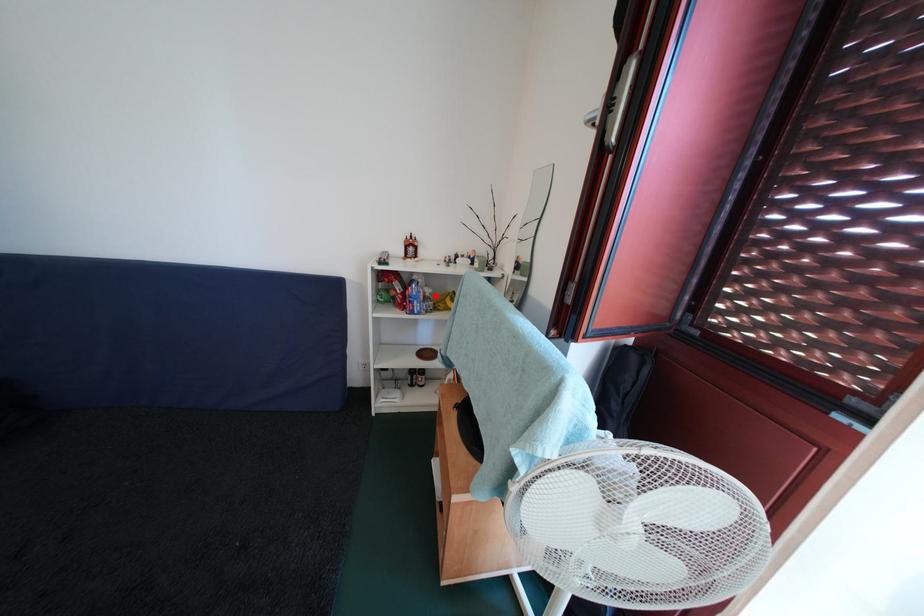
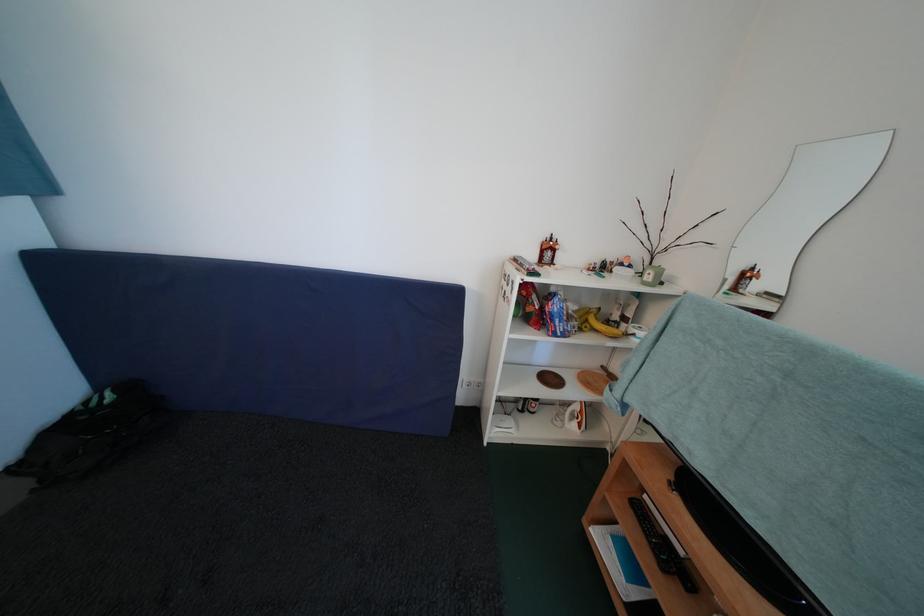
In the second image, find the point that corresponds to the highlighted location in the first image.

(579, 313)